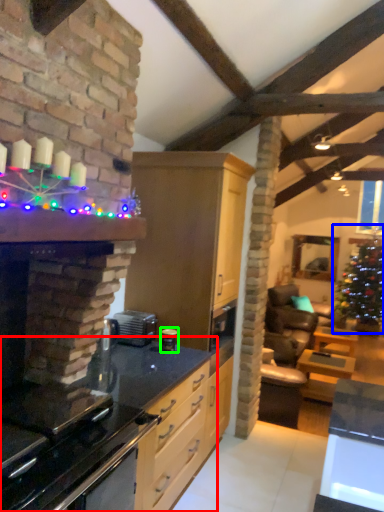
Question: Which object is positioned closest to countertop (highlighted by a red box)? Select from christmas tree (highlighted by a blue box) and appliance (highlighted by a green box).

Choices:
 (A) christmas tree
 (B) appliance

Answer: (B)